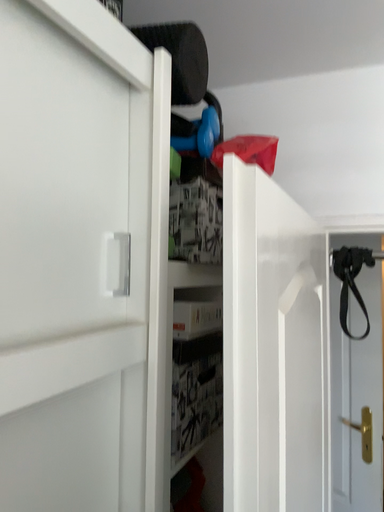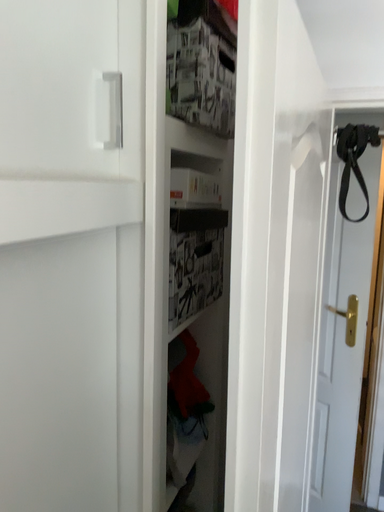
Question: Which way did the camera rotate in the video?

Choices:
 (A) rotated upward
 (B) rotated downward

Answer: (B)